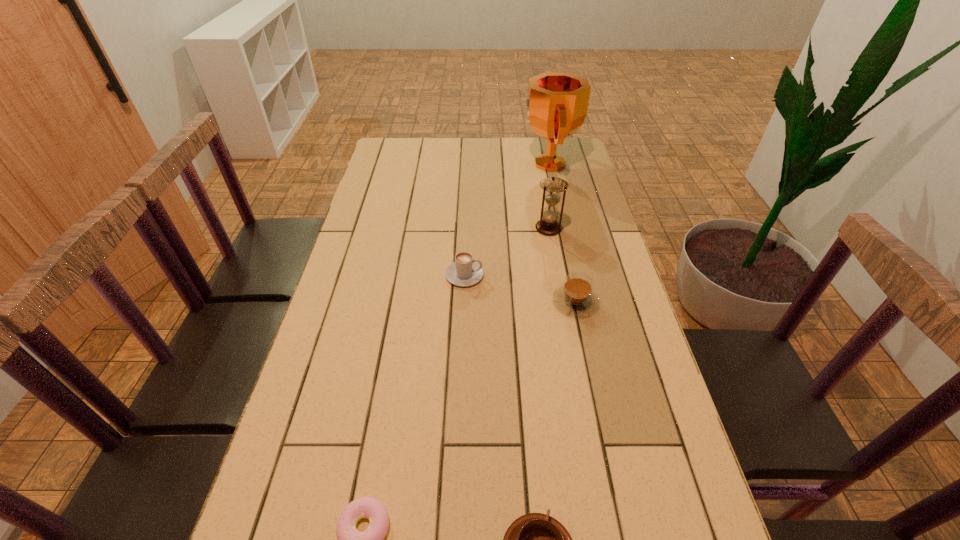
The image size is (960, 540). What are the coordinates of `vacant space located 0.360m on the back of the rightmost cappuccino` in the screenshot? It's located at (556, 211).

You are a GUI agent. You are given a task and a screenshot of the screen. Output one action in this format:
    pyautogui.click(x=<x>, y=<y>)
    Task: Click on the free space located to the right of the leftmost cappuccino
    Image resolution: width=960 pixels, height=540 pixels.
    Given the screenshot: What is the action you would take?
    pyautogui.click(x=569, y=275)

Find the location of a particular element. object at the far edge is located at coordinates (556, 106).

The height and width of the screenshot is (540, 960). In order to click on award that is positioned at the right edge in this screenshot , I will do `click(556, 106)`.

Locate an element on the screen. This screenshot has width=960, height=540. hourglass that is at the right edge is located at coordinates (552, 186).

You are a GUI agent. You are given a task and a screenshot of the screen. Output one action in this format:
    pyautogui.click(x=<x>, y=<y>)
    Task: Click on the cappuccino that is at the right edge
    The image size is (960, 540).
    Given the screenshot: What is the action you would take?
    pyautogui.click(x=575, y=297)

Identify the location of object positioned at the far right corner. This screenshot has width=960, height=540. (556, 106).

At what (x,y) coordinates should I click in order to perform the action: click on vacant space at the far edge. Please return your answer as a coordinate pair (x, y). The width and height of the screenshot is (960, 540). Looking at the image, I should click on (473, 161).

The height and width of the screenshot is (540, 960). In the image, there is a desktop. What are the coordinates of `vacant space at the left edge` in the screenshot? It's located at (365, 237).

Find the location of `free space at the right edge of the desktop`. free space at the right edge of the desktop is located at coordinates (570, 184).